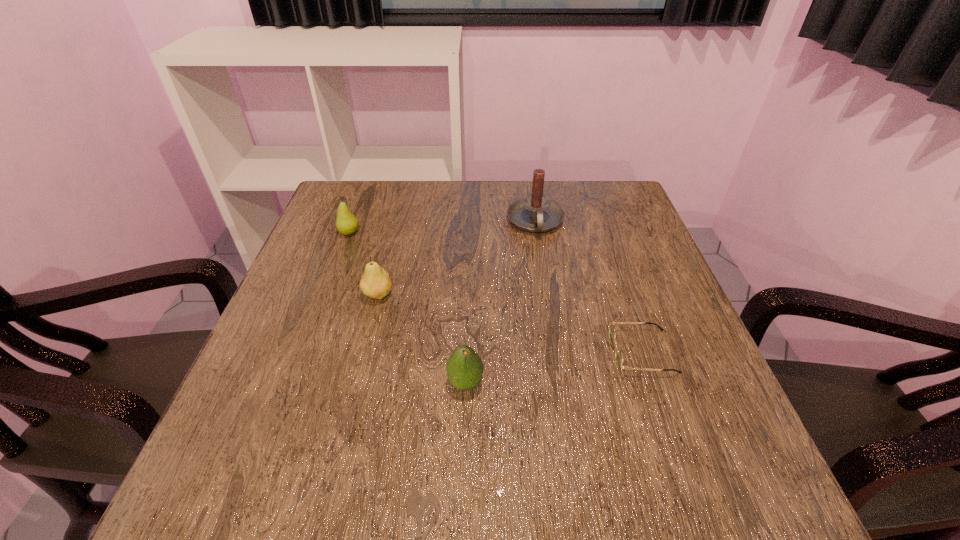
The image size is (960, 540). I want to click on free space located on the right of the leftmost object, so click(x=459, y=233).

This screenshot has width=960, height=540. Identify the location of vacant space located 0.150m on the right of the second object from left to right. (461, 295).

At what (x,y) coordinates should I click in order to perform the action: click on vacant space located 0.070m on the left of the third object from left to right. Please return your answer as a coordinate pair (x, y). Looking at the image, I should click on (409, 383).

Find the location of `free space located on the lenses of the rightmost object`. free space located on the lenses of the rightmost object is located at coordinates (586, 352).

Where is `free space located 0.070m on the lenses of the rightmost object`? Image resolution: width=960 pixels, height=540 pixels. free space located 0.070m on the lenses of the rightmost object is located at coordinates (575, 352).

The width and height of the screenshot is (960, 540). I want to click on vacant area situated 0.210m on the lenses of the rightmost object, so click(x=504, y=352).

You are a GUI agent. You are given a task and a screenshot of the screen. Output one action in this format:
    pyautogui.click(x=<x>, y=<y>)
    Task: Click on the candle at the far edge
    The image size is (960, 540).
    Given the screenshot: What is the action you would take?
    pyautogui.click(x=535, y=213)

Locate an element on the screen. Image resolution: width=960 pixels, height=540 pixels. pear located at the far edge is located at coordinates (346, 223).

Where is `object that is at the left edge`? The image size is (960, 540). object that is at the left edge is located at coordinates tap(346, 223).

Locate an element on the screen. This screenshot has width=960, height=540. object positioned at the right edge is located at coordinates tap(618, 352).